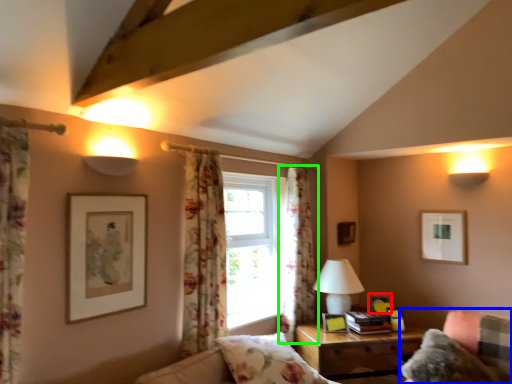
Question: Estimate the real-world distances between objects in this image. Which object is farther from picture frame (highlighted by a red box), couch (highlighted by a blue box) or curtain (highlighted by a green box)?

Choices:
 (A) couch
 (B) curtain

Answer: (B)